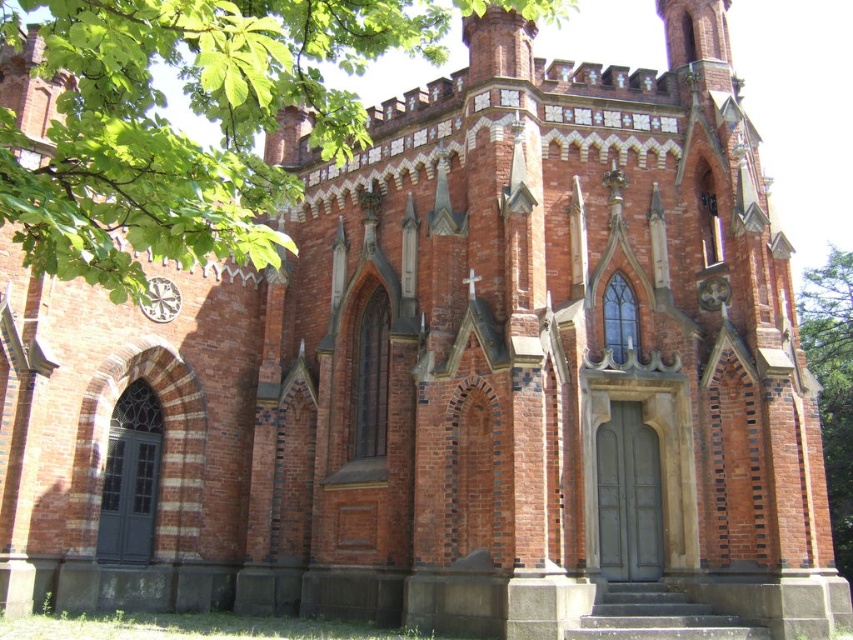
You are standing in front of the Gothic building and want to take a photo that includes both the green leafy tree at right and the central arched doorway. Which direction should you move to ensure both are in the frame?

Since the green leafy tree at right is positioned at point (833, 385), you should move to the left to ensure both the tree and the central arched doorway are in the frame.

You are standing in front of the Gothic building and want to locate the white ceramic clock at center. Which direction should you look relative to the green leafy tree at upper left?

The white ceramic clock at center is to the right of the green leafy tree at upper left, so you should look to the right of the green leafy tree at upper left to locate the white ceramic clock at center.

You are standing at the base of the green leafy tree at upper left and want to take a photo of the Gothic building. The camera you have can capture objects up to 80 feet away. Will you be able to take a clear photo of the building with your current position?

The green leafy tree at upper left and camera are 77.07 feet apart. Since the camera can capture objects up to 80 feet away, you can take a clear photo of the building from your current position as the distance is within the camera range.